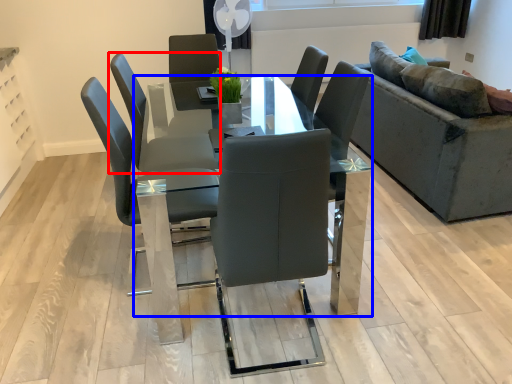
Question: Which of the following is the closest to the observer, chair (highlighted by a red box) or table (highlighted by a blue box)?

Choices:
 (A) chair
 (B) table

Answer: (B)